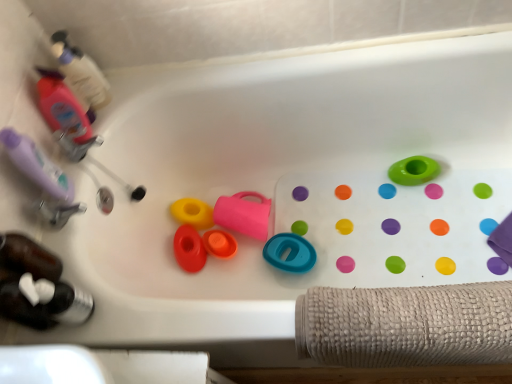
Where is `vacant area that lies in front of translucent pink bottle at upper left, the second bottle in the top-to-bottom sequence`? This screenshot has height=384, width=512. vacant area that lies in front of translucent pink bottle at upper left, the second bottle in the top-to-bottom sequence is located at coordinates (77, 179).